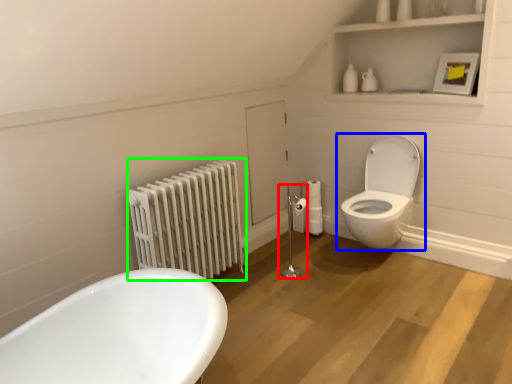
Question: Which is nearer to the shower (highlighted by a red box)? toilet (highlighted by a blue box) or radiator (highlighted by a green box).

Choices:
 (A) toilet
 (B) radiator

Answer: (A)